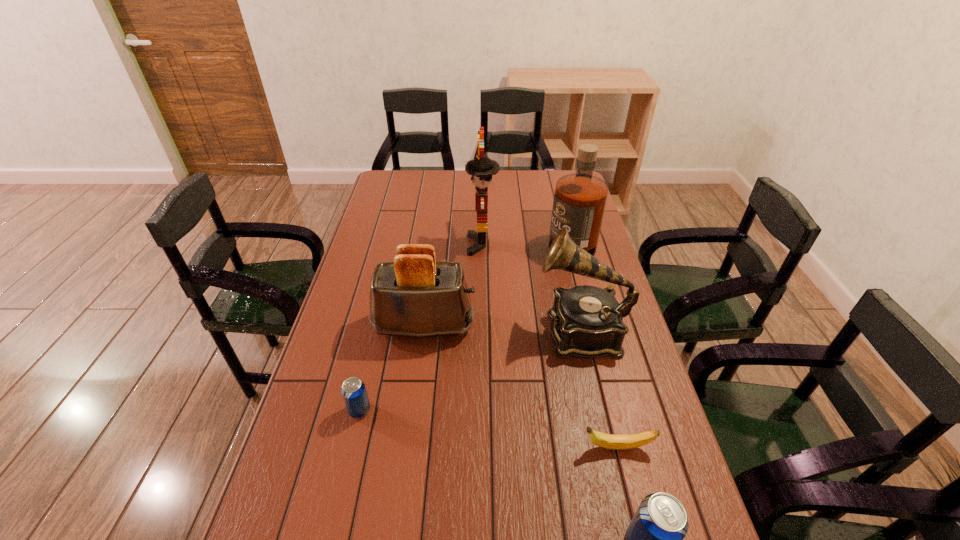
The width and height of the screenshot is (960, 540). In order to click on free space located at the stem of the banana in this screenshot , I will do `click(482, 447)`.

Where is `free region located at the stem of the banana`? The image size is (960, 540). free region located at the stem of the banana is located at coordinates (540, 447).

I want to click on beer can positioned at the left edge, so click(353, 390).

What are the coordinates of `toaster located at the left edge` in the screenshot? It's located at (415, 296).

Find the location of a particular element. phonograph record that is positioned at the right edge is located at coordinates (587, 322).

At what (x,y) coordinates should I click in order to perform the action: click on liquor that is at the right edge. Please return your answer as a coordinate pair (x, y). This screenshot has width=960, height=540. Looking at the image, I should click on (580, 198).

The image size is (960, 540). What are the coordinates of `banana at the right edge` in the screenshot? It's located at (628, 441).

Where is `free space at the far edge`? The image size is (960, 540). free space at the far edge is located at coordinates (540, 170).

I want to click on vacant space at the left edge of the desktop, so click(287, 458).

You are a GUI agent. You are given a task and a screenshot of the screen. Output one action in this format:
    pyautogui.click(x=<x>, y=<y>)
    Task: Click on the free spot at the far left corner of the desktop
    This screenshot has width=960, height=540.
    Given the screenshot: What is the action you would take?
    pyautogui.click(x=417, y=177)